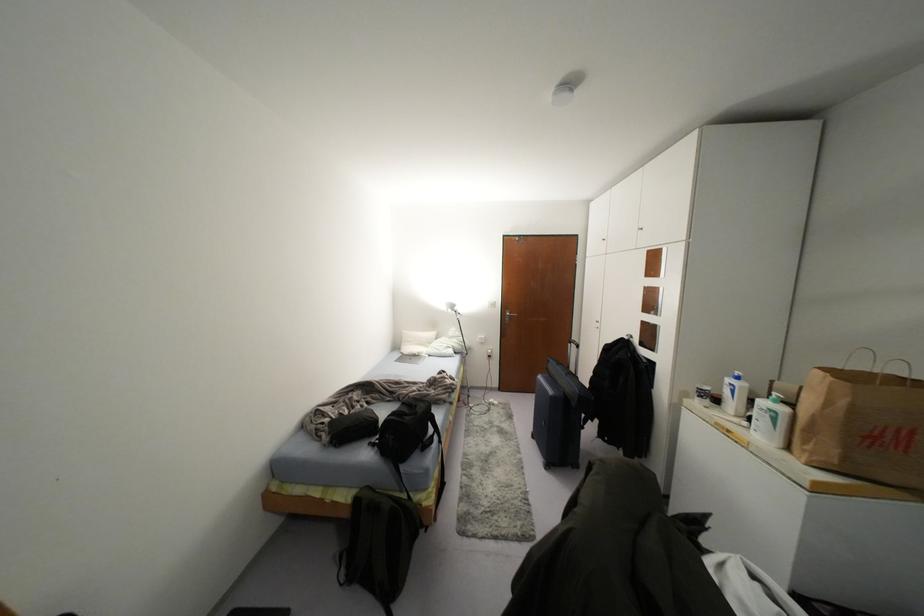
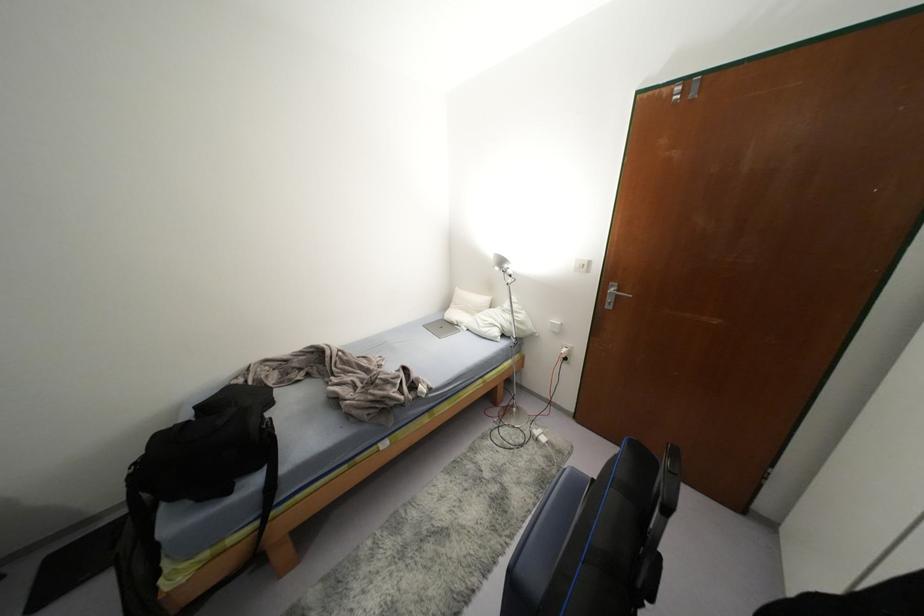
The point at (455, 308) is marked in the first image. Where is the corresponding point in the second image?

(505, 265)